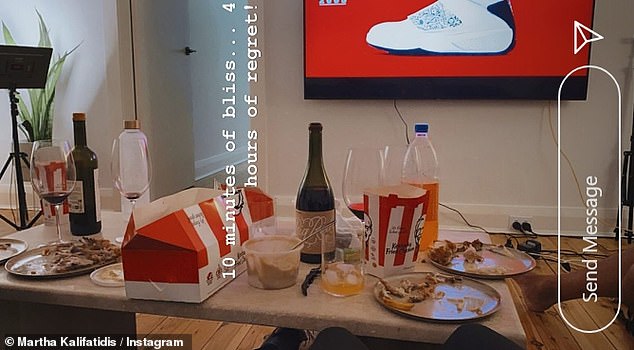
Identify the location of plates with food remains. (78, 263), (429, 302), (476, 259).